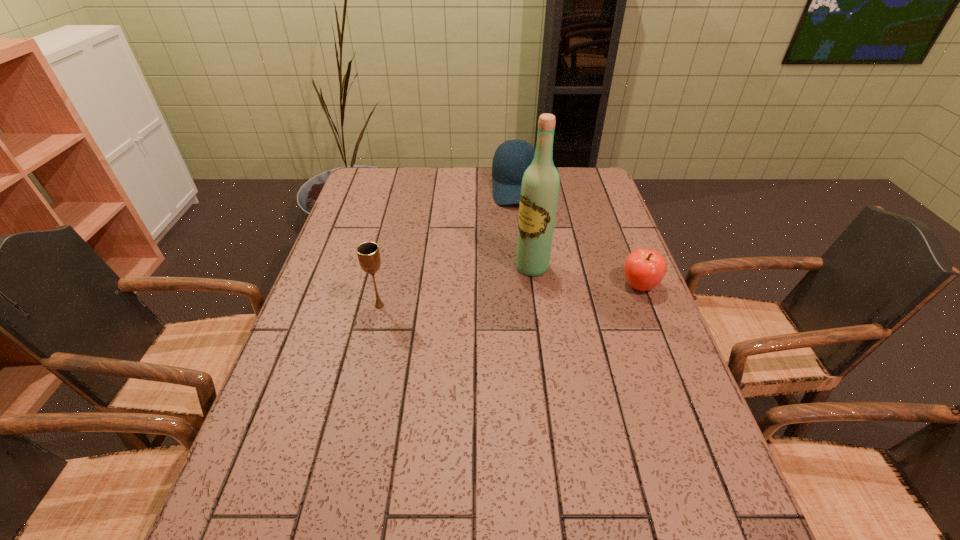
The width and height of the screenshot is (960, 540). Find the location of `empty location between the farthest object and the rightmost object`. empty location between the farthest object and the rightmost object is located at coordinates (577, 237).

Where is `object that is the second closest to the wine bottle`? object that is the second closest to the wine bottle is located at coordinates [x=507, y=170].

Where is `object that stands as the third closest to the chalice`? The height and width of the screenshot is (540, 960). object that stands as the third closest to the chalice is located at coordinates (644, 269).

Find the location of a particular element. The image size is (960, 540). free point that satisfies the following two spatial constraints: 1. on the front side of the second shortest object; 2. on the right side of the shortest object is located at coordinates (526, 286).